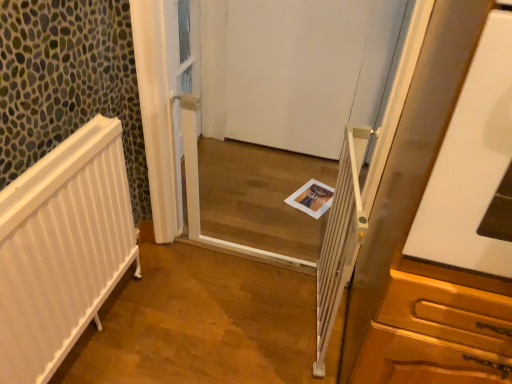
The height and width of the screenshot is (384, 512). I want to click on vacant area situated to the left side of white paper magazine at center, so click(268, 190).